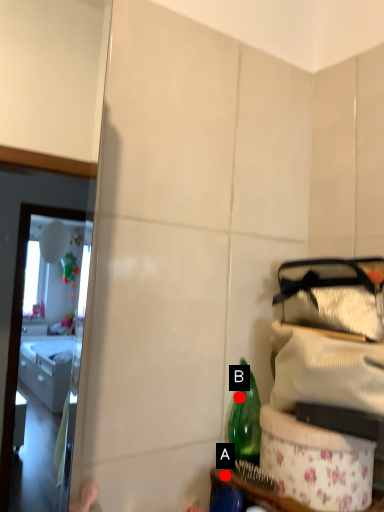
Question: Two points are circled on the image, labeled by A and B beside each circle. Which of the following is the farthest from the observer?

Choices:
 (A) A is further
 (B) B is further

Answer: (B)